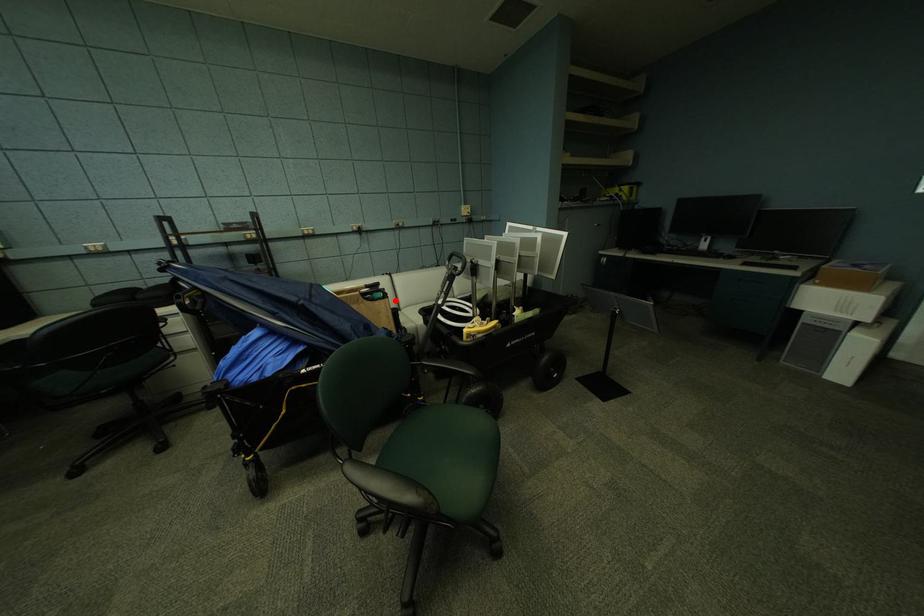
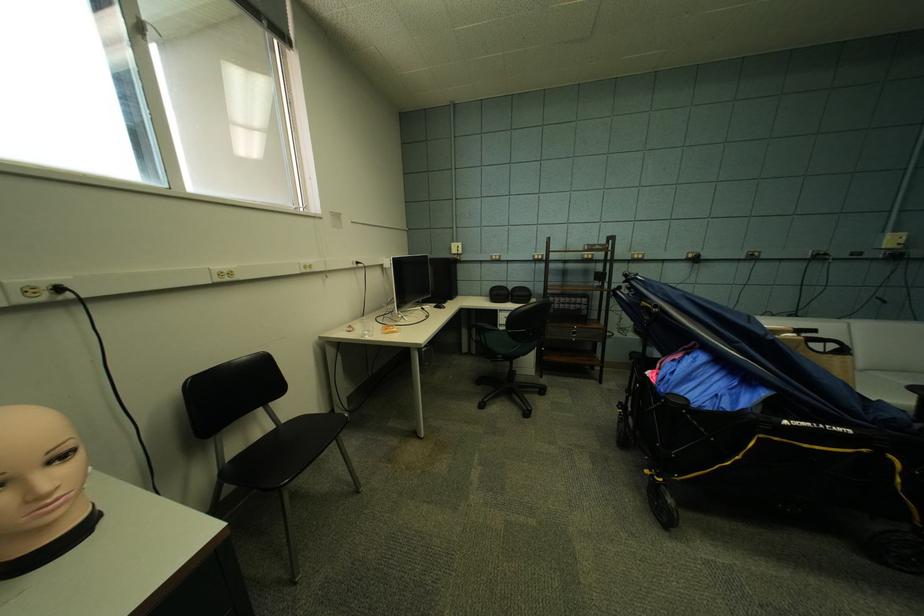
Question: I am providing you with two images of the same scene from different viewpoints. Image1 has a red point marked. In image2, the corresponding 3D location appears at what relative position? Reply with the corresponding letter.

Choices:
 (A) Closer
 (B) Farther

Answer: (B)